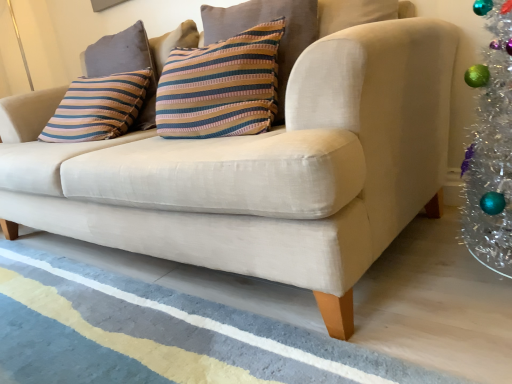
Question: Is striped fabric pillow at upper left, which is the 1th pillow in left-to-right order, positioned before blue textured rug at lower center?

Choices:
 (A) no
 (B) yes

Answer: (A)

Question: Are striped fabric pillow at upper left, the 1th pillow positioned from the back, and blue textured rug at lower center located far from each other?

Choices:
 (A) yes
 (B) no

Answer: (B)

Question: Considering the relative sizes of striped fabric pillow at upper left, the 1th pillow positioned from the back, and blue textured rug at lower center in the image provided, is striped fabric pillow at upper left, the 1th pillow positioned from the back, taller than blue textured rug at lower center?

Choices:
 (A) no
 (B) yes

Answer: (B)

Question: Would you say striped fabric pillow at upper left, the 1th pillow positioned from the back, contains blue textured rug at lower center?

Choices:
 (A) yes
 (B) no

Answer: (B)

Question: From a real-world perspective, is striped fabric pillow at upper left, which appears as the 2th pillow when viewed from the front, on blue textured rug at lower center?

Choices:
 (A) no
 (B) yes

Answer: (B)

Question: Is striped fabric pillow at center, the 2th pillow viewed from the left, inside the boundaries of blue textured rug at lower center, or outside?

Choices:
 (A) outside
 (B) inside

Answer: (A)

Question: Considering the positions of striped fabric pillow at center, acting as the first pillow starting from the right, and blue textured rug at lower center in the image, is striped fabric pillow at center, acting as the first pillow starting from the right, bigger or smaller than blue textured rug at lower center?

Choices:
 (A) big
 (B) small

Answer: (A)

Question: From a real-world perspective, is striped fabric pillow at center, acting as the first pillow starting from the right, above or below blue textured rug at lower center?

Choices:
 (A) above
 (B) below

Answer: (A)

Question: From the image's perspective, relative to blue textured rug at lower center, is striped fabric pillow at center, acting as the first pillow starting from the right, above or below?

Choices:
 (A) above
 (B) below

Answer: (A)

Question: From their relative heights in the image, would you say striped fabric pillow at center, acting as the first pillow starting from the right, is taller or shorter than striped fabric pillow at upper left, which appears as the 2th pillow when viewed from the front?

Choices:
 (A) short
 (B) tall

Answer: (B)

Question: Which is correct: striped fabric pillow at center, which is the second pillow in back-to-front order, is inside striped fabric pillow at upper left, which appears as the 2th pillow when viewed from the front, or outside of it?

Choices:
 (A) outside
 (B) inside

Answer: (A)

Question: Looking at the image, does striped fabric pillow at center, which appears as the first pillow when viewed from the front, seem bigger or smaller compared to striped fabric pillow at upper left, the 1th pillow positioned from the back?

Choices:
 (A) small
 (B) big

Answer: (B)

Question: From a real-world perspective, is striped fabric pillow at center, the 2th pillow viewed from the left, physically located above or below striped fabric pillow at upper left, which is the 1th pillow in left-to-right order?

Choices:
 (A) below
 (B) above

Answer: (A)

Question: Does point (47, 286) appear closer or farther from the camera than point (92, 66)?

Choices:
 (A) farther
 (B) closer

Answer: (B)

Question: Is blue textured rug at lower center in front of or behind striped fabric pillow at upper left, the 1th pillow positioned from the back, in the image?

Choices:
 (A) behind
 (B) front

Answer: (B)